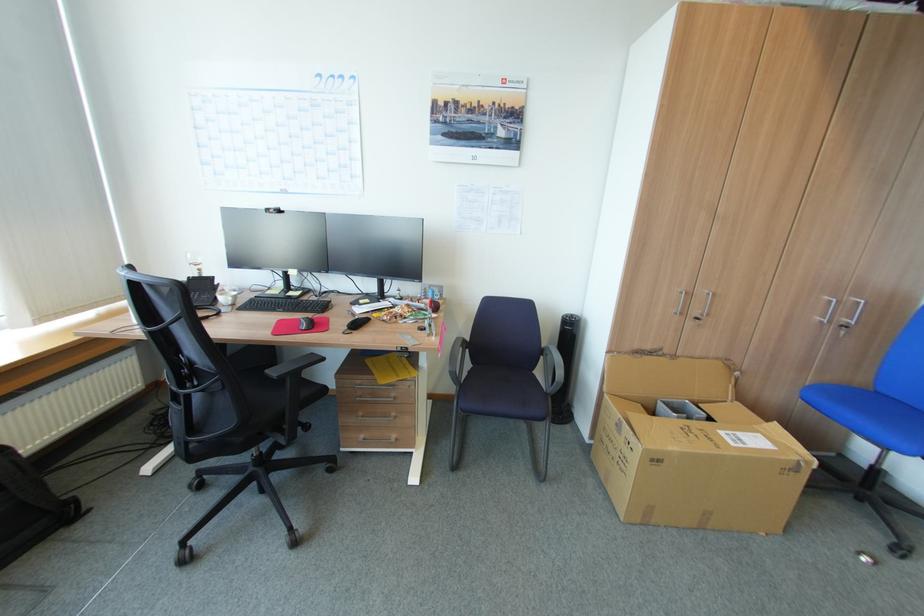
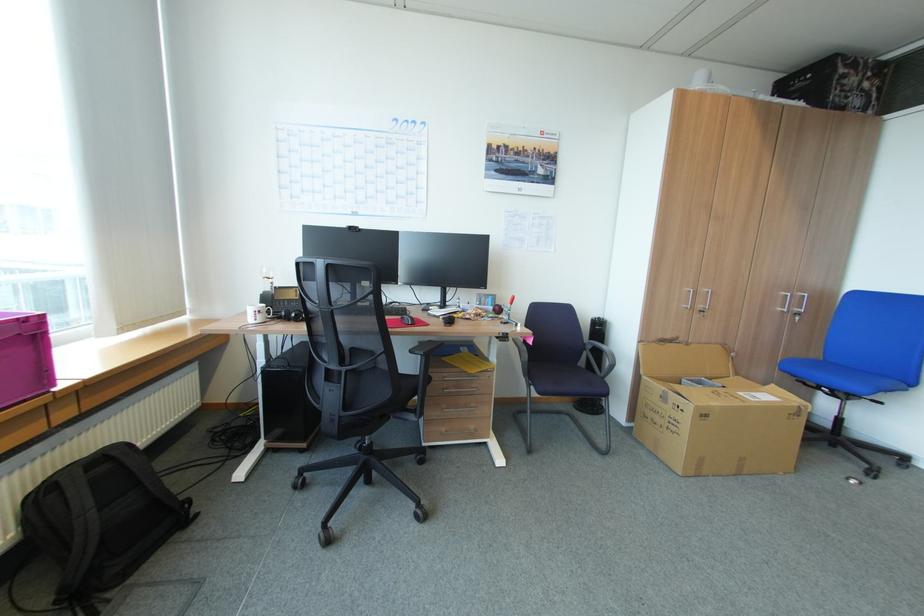
Where in the second image is the point corresponding to pixel 548 346 from the first image?

(590, 342)